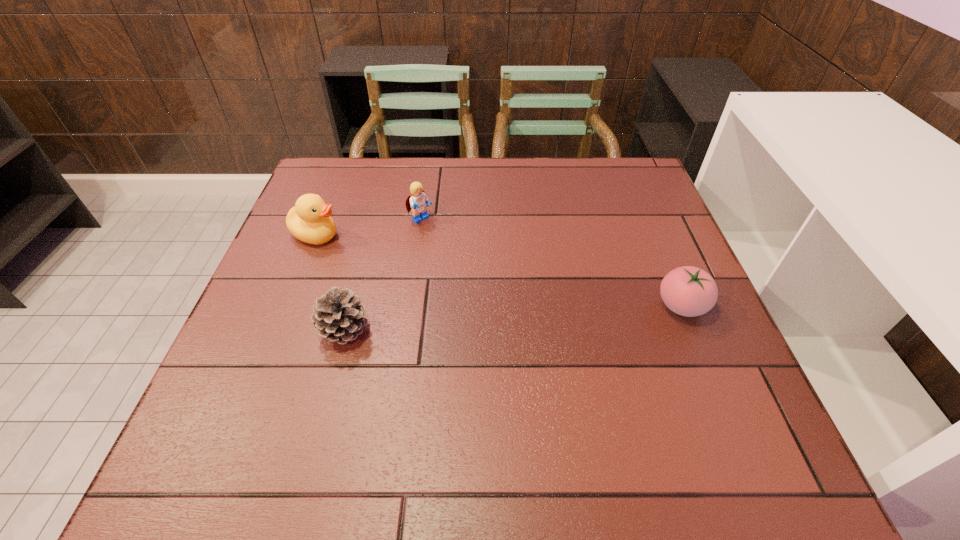
In the image, there is a desktop. Identify the location of vacant space at the near left corner. The width and height of the screenshot is (960, 540). (239, 398).

Where is `vacant point at the far right corner`? vacant point at the far right corner is located at coordinates (602, 184).

In the image, there is a desktop. At what (x,y) coordinates should I click in order to perform the action: click on vacant space at the near right corner. Please return your answer as a coordinate pair (x, y). Looking at the image, I should click on (694, 409).

Locate an element on the screen. This screenshot has width=960, height=540. vacant area that lies between the third object from left to right and the pinecone is located at coordinates (382, 275).

Find the location of a particular element. This screenshot has height=540, width=960. vacant point located between the rightmost object and the third object from left to right is located at coordinates (551, 263).

Where is `free space between the pinecone and the duck`? The image size is (960, 540). free space between the pinecone and the duck is located at coordinates (330, 282).

This screenshot has width=960, height=540. Find the location of `unoccupied position between the second object from right to left and the pinecone`. unoccupied position between the second object from right to left and the pinecone is located at coordinates (382, 275).

Locate an element on the screen. Image resolution: width=960 pixels, height=540 pixels. vacant point located between the rightmost object and the third object from right to left is located at coordinates (513, 318).

Find the location of `vacant space in between the duck and the Lego`. vacant space in between the duck and the Lego is located at coordinates (369, 227).

In order to click on free space that is in between the Lego and the rightmost object in this screenshot , I will do `click(551, 263)`.